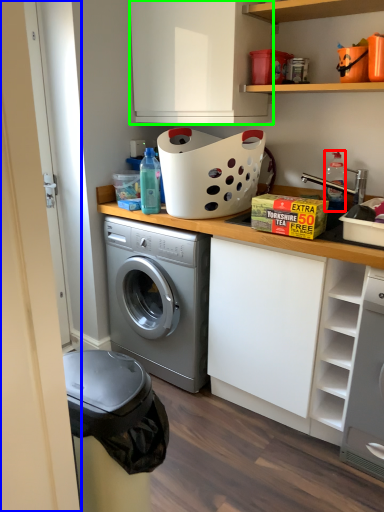
Question: Which is nearer to the bottle (highlighted by a red box)? door (highlighted by a blue box) or cabinetry (highlighted by a green box).

Choices:
 (A) door
 (B) cabinetry

Answer: (B)